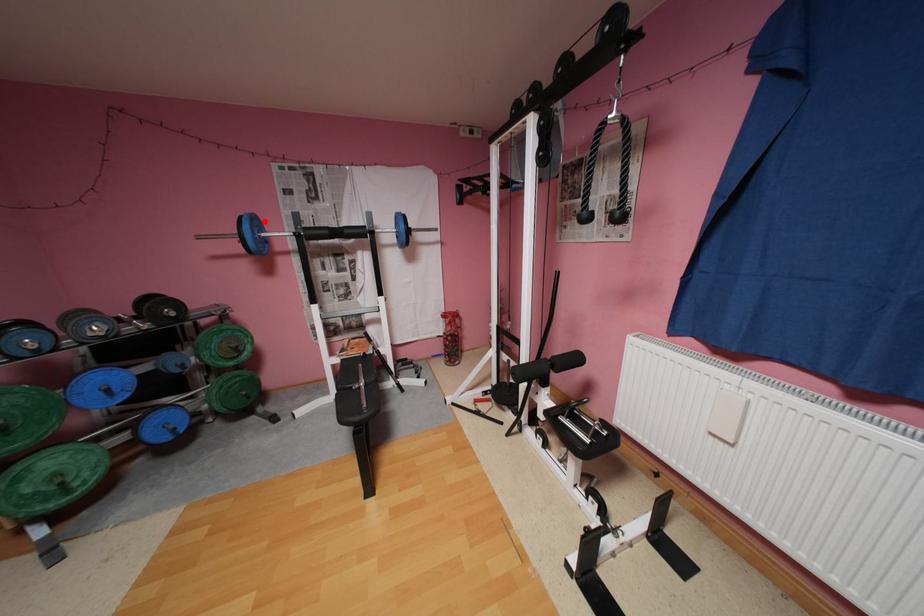
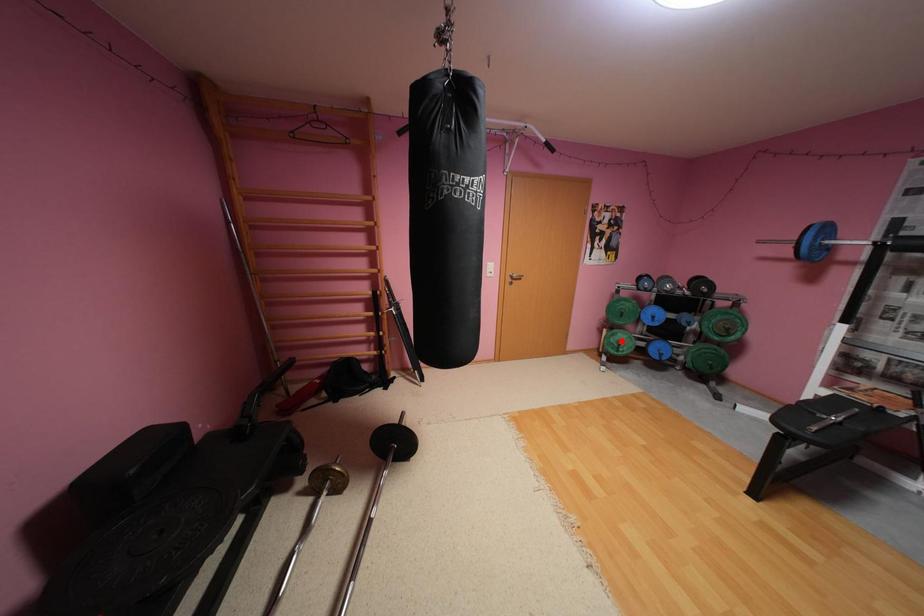
I am providing you with two images of the same scene from different viewpoints. A red point is marked on the first image and another point is marked on the second image. Is the marked point in image1 the same physical position as the marked point in image2?

No